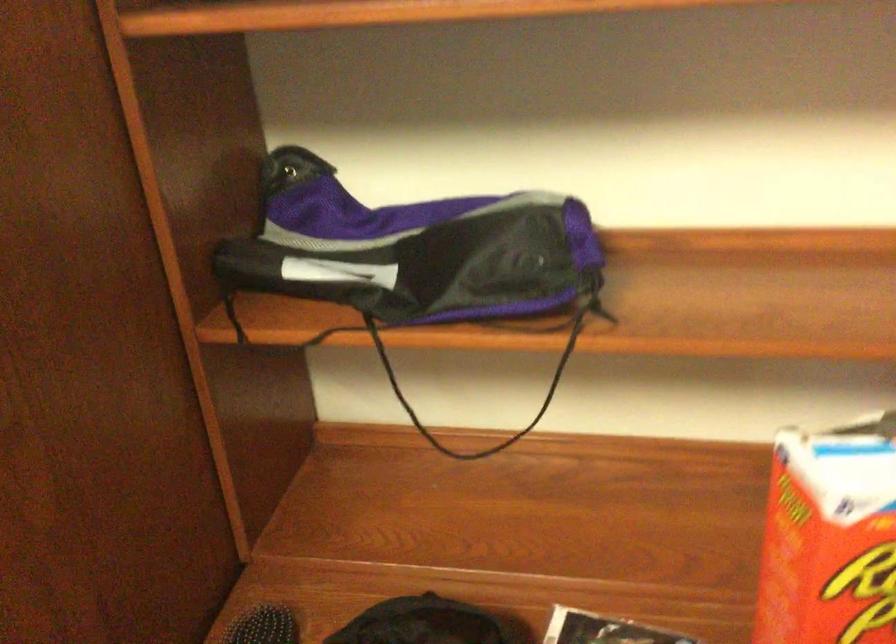
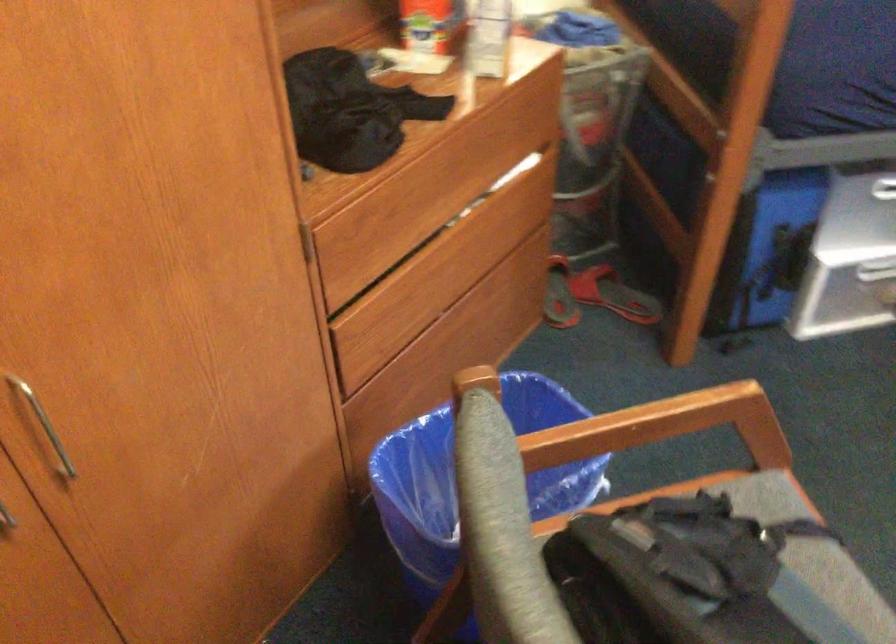
Question: I am providing you with two images of the same scene from different viewpoints. After the viewpoint changes to image2, which objects are now occluded?

Choices:
 (A) red sandal
 (B) metal cabinet handle
 (C) blue brush handle
 (D) black hairbrush

Answer: (D)